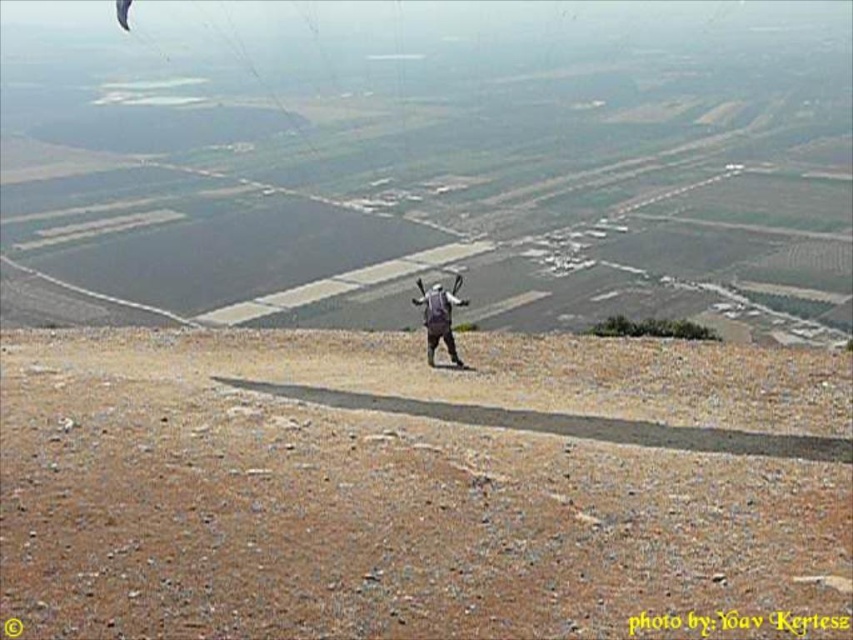
Question: Can you confirm if brown gravel at center is wider than matte gray backpack at center?

Choices:
 (A) no
 (B) yes

Answer: (B)

Question: Which point appears closest to the camera in this image?

Choices:
 (A) (793, 497)
 (B) (453, 342)

Answer: (A)

Question: Among these objects, which one is nearest to the camera?

Choices:
 (A) matte gray backpack at center
 (B) brown gravel at center

Answer: (B)

Question: Does brown gravel at center appear on the right side of matte gray backpack at center?

Choices:
 (A) no
 (B) yes

Answer: (B)

Question: Among these points, which one is nearest to the camera?

Choices:
 (A) (442, 308)
 (B) (169, 525)

Answer: (B)

Question: Can you confirm if brown gravel at center is positioned above matte gray backpack at center?

Choices:
 (A) no
 (B) yes

Answer: (A)